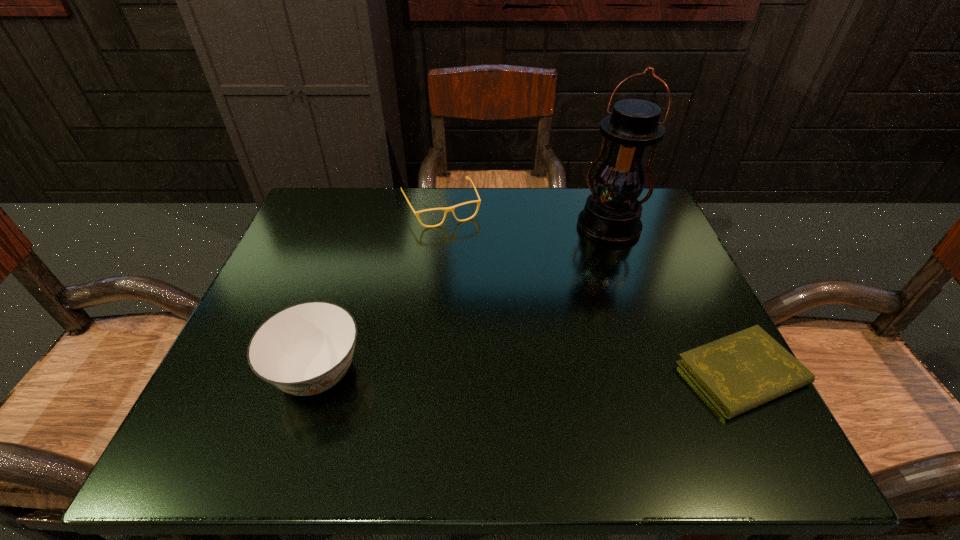
Locate an element on the screen. This screenshot has height=540, width=960. vacant area located in front of the lenses of the third tallest object is located at coordinates (463, 251).

Where is `vacant space located in front of the lenses of the third tallest object`? Image resolution: width=960 pixels, height=540 pixels. vacant space located in front of the lenses of the third tallest object is located at coordinates (486, 299).

The height and width of the screenshot is (540, 960). What are the coordinates of `lantern at the far edge` in the screenshot? It's located at (611, 215).

Identify the location of spectacles present at the far edge. (447, 209).

Find the location of a particular element. The width and height of the screenshot is (960, 540). soup bowl located in the near edge section of the desktop is located at coordinates (305, 349).

Where is `diary that is at the near edge`? diary that is at the near edge is located at coordinates pos(737,373).

The width and height of the screenshot is (960, 540). Find the location of `object situated at the left edge`. object situated at the left edge is located at coordinates (305, 349).

I want to click on diary that is at the right edge, so click(x=737, y=373).

Find the location of a particular element. The height and width of the screenshot is (540, 960). lantern present at the right edge is located at coordinates (611, 215).

Image resolution: width=960 pixels, height=540 pixels. What are the coordinates of `object located in the near left corner section of the desktop` in the screenshot? It's located at (305, 349).